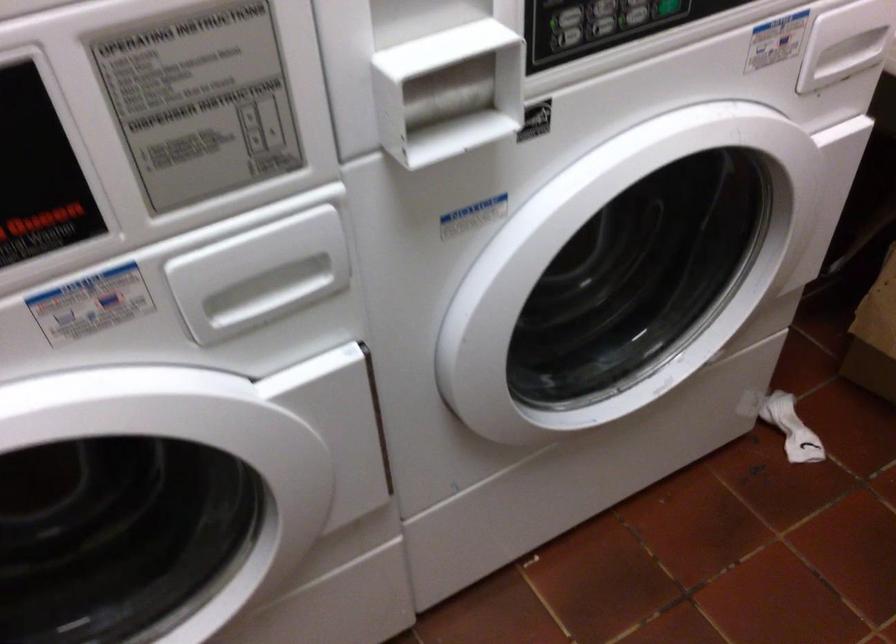
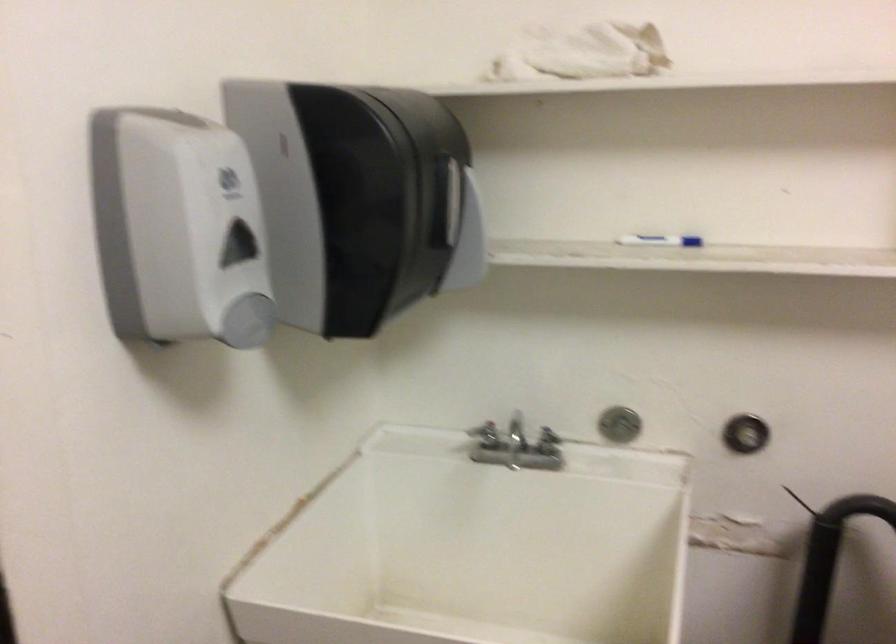
Question: The images are taken continuously from a first-person perspective. In which direction is your viewpoint rotating?

Choices:
 (A) Left
 (B) Right
 (C) Up
 (D) Down

Answer: (A)